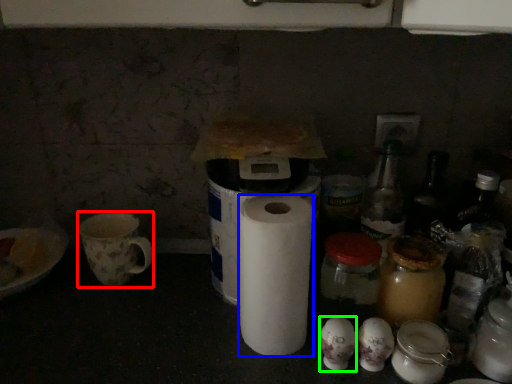
Question: Which object is positioned closest to mug (highlighted by a red box)? Select from paper towel (highlighted by a blue box) and toilet paper (highlighted by a green box).

Choices:
 (A) paper towel
 (B) toilet paper

Answer: (A)